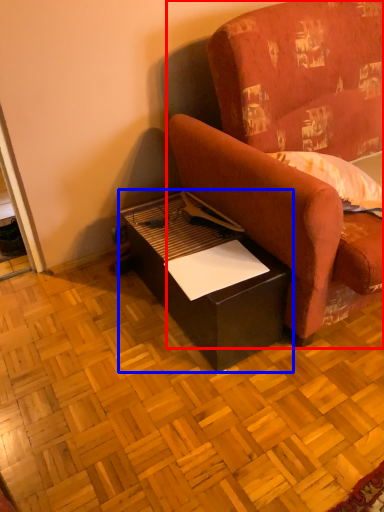
Question: Which of the following is the closest to the observer, studio couch (highlighted by a red box) or table (highlighted by a blue box)?

Choices:
 (A) studio couch
 (B) table

Answer: (A)